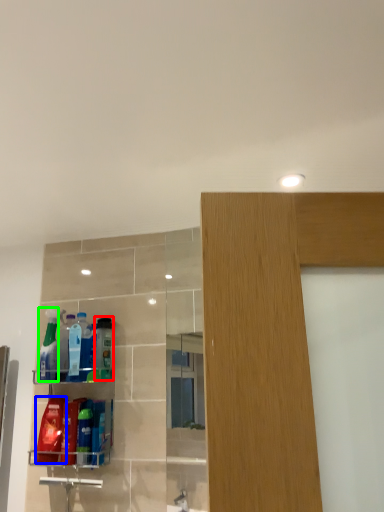
Question: Which is nearer to the cleaning product (highlighted by a red box)? cleaning product (highlighted by a blue box) or cleaning product (highlighted by a green box).

Choices:
 (A) cleaning product
 (B) cleaning product

Answer: (B)